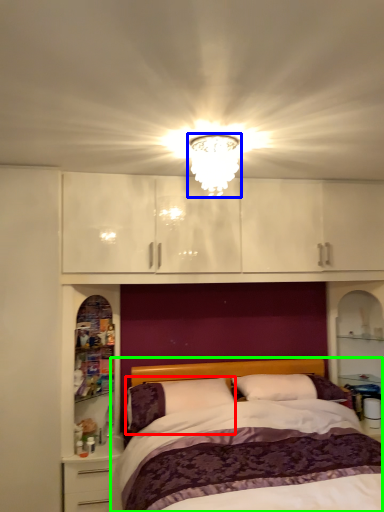
Question: Which object is positioned farthest from pillow (highlighted by a red box)? Select from light fixture (highlighted by a blue box) and bed (highlighted by a green box).

Choices:
 (A) light fixture
 (B) bed

Answer: (A)